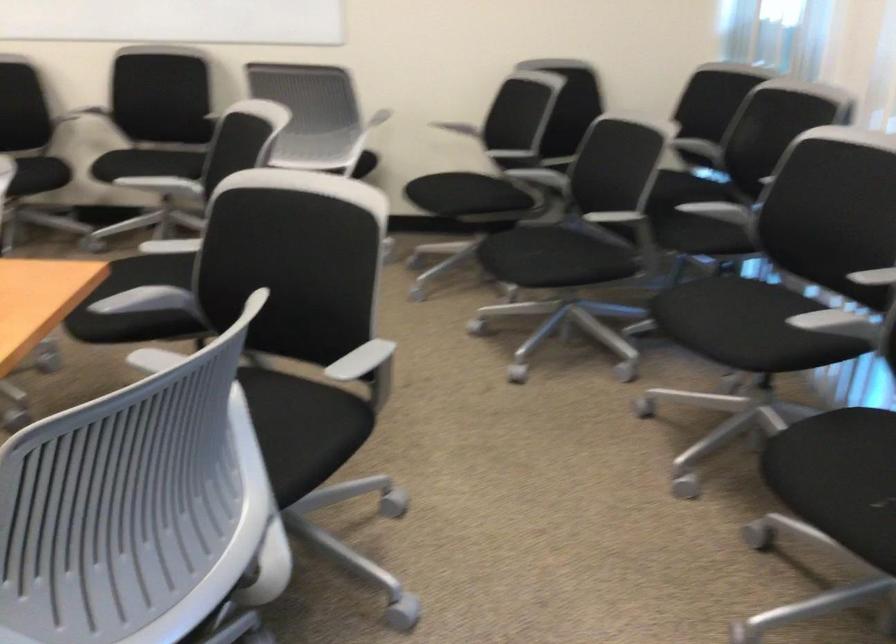
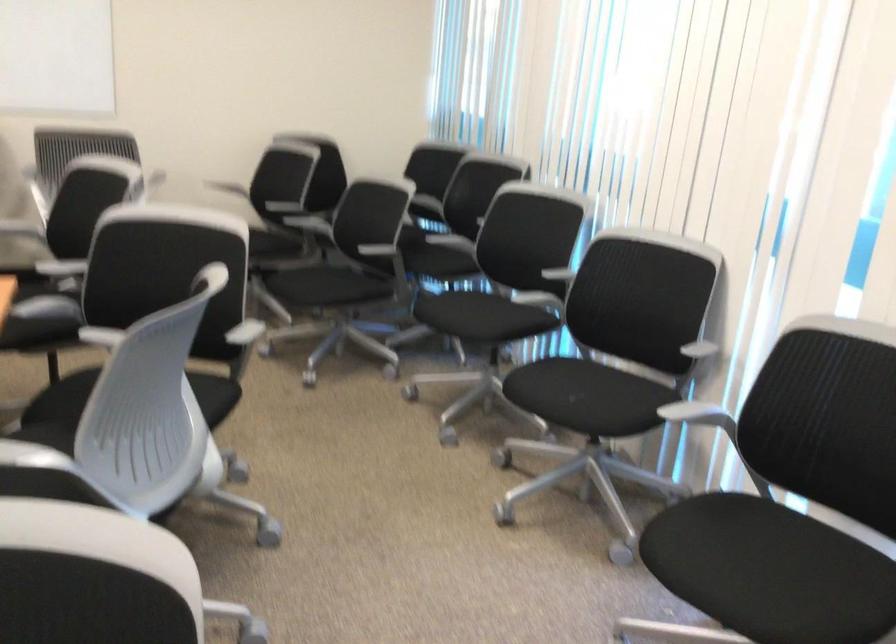
Question: The camera is either moving clockwise (left) or counter-clockwise (right) around the object. The first image is from the beginning of the video and the second image is from the end. Is the camera moving left or right when shooting the video?

Choices:
 (A) Left
 (B) Right

Answer: (A)